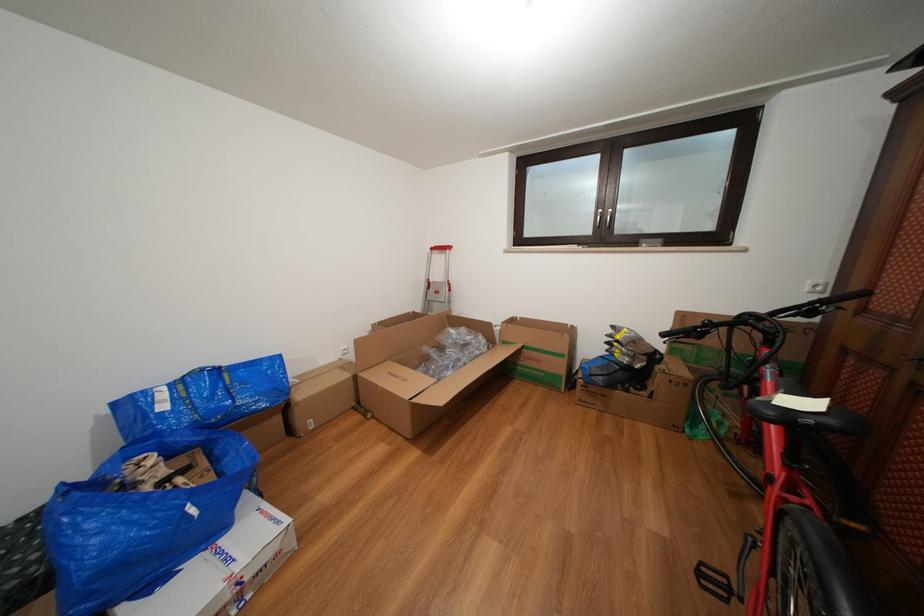
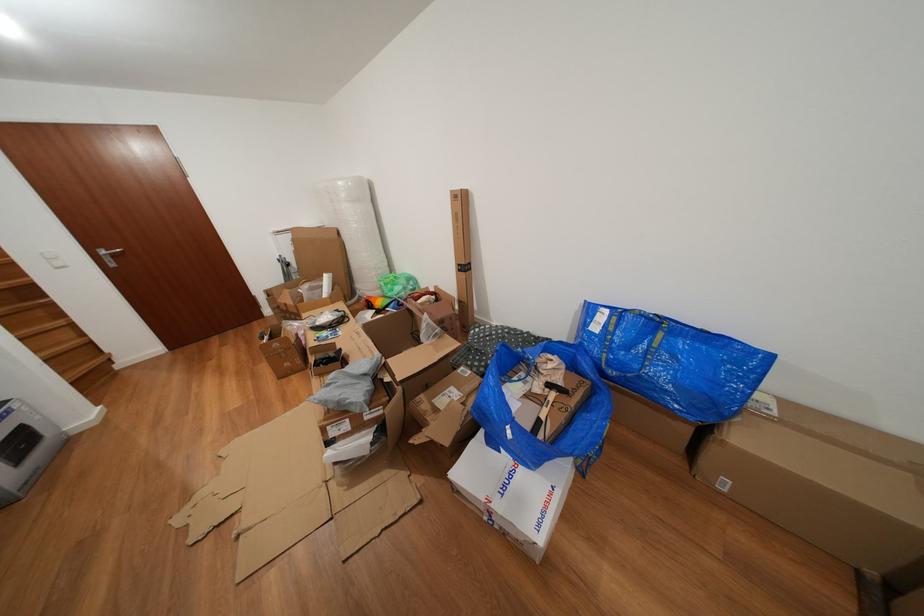
Based on the continuous images, in which direction is the camera rotating?

The camera's rotation is toward left-down.